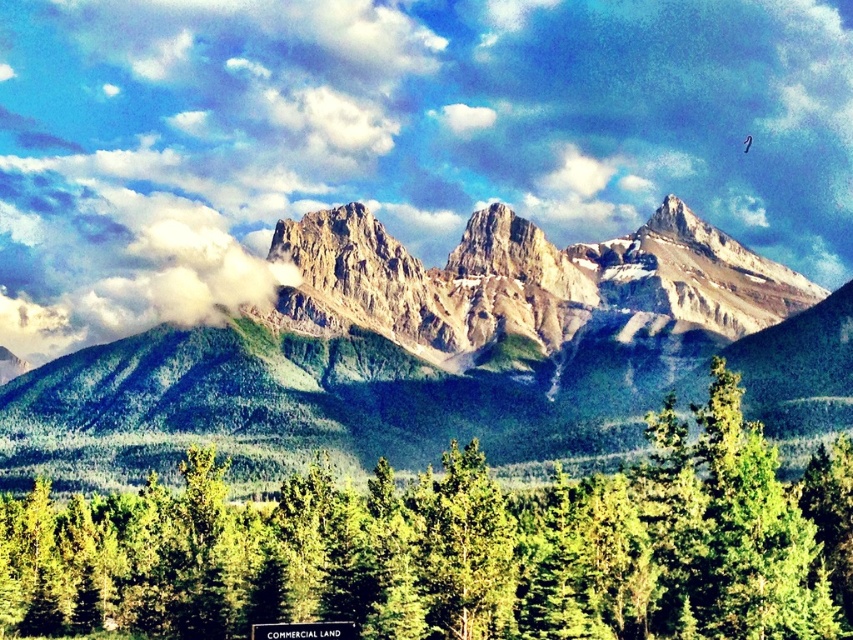
Which is more to the right, white fluffy cloud at upper center or green matte pine forest at lower center?

From the viewer's perspective, white fluffy cloud at upper center appears more on the right side.

Can you confirm if white fluffy cloud at upper center is positioned to the right of green matte pine forest at lower center?

Correct, you'll find white fluffy cloud at upper center to the right of green matte pine forest at lower center.

You are a GUI agent. You are given a task and a screenshot of the screen. Output one action in this format:
    pyautogui.click(x=<x>, y=<y>)
    Task: Click on the white fluffy cloud at upper center
    
    Given the screenshot: What is the action you would take?
    pyautogui.click(x=393, y=136)

Between white fluffy cloud at upper center and rugged stone mountain range at center, which one has less height?

rugged stone mountain range at center

Is point (705, 148) positioned behind point (595, 268)?

Yes.

Between point (160, 220) and point (694, 252), which one is positioned behind?

Positioned behind is point (160, 220).

Identify the location of white fluffy cloud at upper center. (393, 136).

Between rugged stone mountain range at center and green matte pine forest at lower center, which one appears on the left side from the viewer's perspective?

green matte pine forest at lower center is more to the left.

Does point (386, 294) come closer to viewer compared to point (730, 566)?

No, (386, 294) is further to viewer.

This screenshot has height=640, width=853. What are the coordinates of `rugged stone mountain range at center` in the screenshot? It's located at (444, 353).